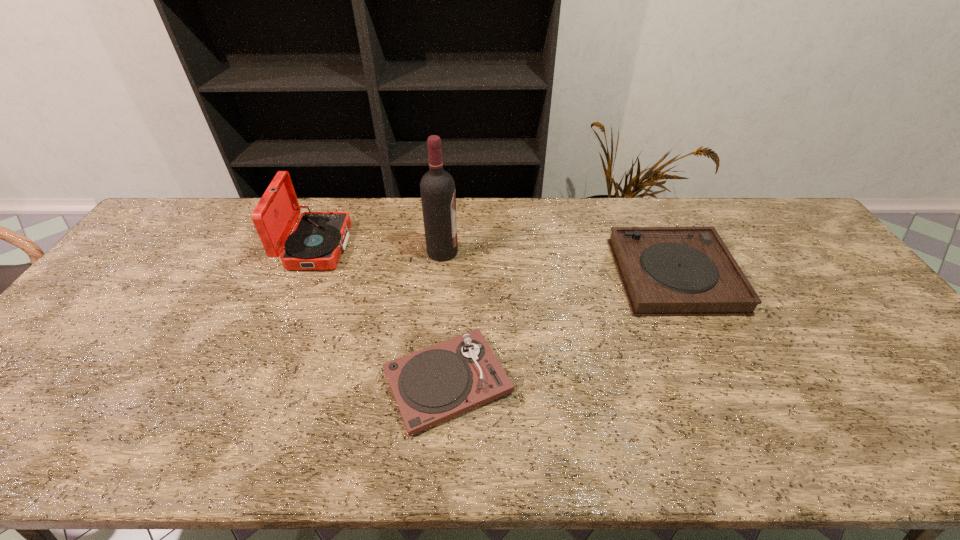
At what (x,y) coordinates should I click in order to perform the action: click on vacant region between the tallest object and the rightmost phonograph_record. Please return your answer as a coordinate pair (x, y). Looking at the image, I should click on (559, 264).

You are a GUI agent. You are given a task and a screenshot of the screen. Output one action in this format:
    pyautogui.click(x=<x>, y=<y>)
    Task: Click on the free space between the tallest object and the nearest object
    This screenshot has height=540, width=960.
    Given the screenshot: What is the action you would take?
    (445, 317)

This screenshot has width=960, height=540. I want to click on free space that is in between the rightmost object and the tallest object, so click(x=559, y=264).

Find the location of a particular element. The width and height of the screenshot is (960, 540). vacant point located between the nearest object and the rightmost phonograph_record is located at coordinates (561, 329).

Find the location of a particular element. This screenshot has width=960, height=540. object that stands as the closest to the rightmost object is located at coordinates (432, 385).

You are a GUI agent. You are given a task and a screenshot of the screen. Output one action in this format:
    pyautogui.click(x=<x>, y=<y>)
    Task: Click on the object that is the third nearest to the nearest object
    
    Given the screenshot: What is the action you would take?
    pyautogui.click(x=666, y=271)

Select which phonograph_record appears as the closest to the second phonograph_record from right to left. Please provide its 2D coordinates. Your answer should be formatted as a tuple, i.e. [(x, y)], where the tuple contains the x and y coordinates of a point satisfying the conditions above.

[(316, 243)]

Identify the location of the second closest phonograph_record relative to the rightmost phonograph_record. (316, 243).

Locate an element on the screen. The image size is (960, 540). vacant area that satisfies the following two spatial constraints: 1. on the back side of the nearest phonograph_record; 2. on the right side of the rightmost phonograph_record is located at coordinates (454, 275).

Image resolution: width=960 pixels, height=540 pixels. In order to click on vacant region that satisfies the following two spatial constraints: 1. on the front-facing side of the leftmost phonograph_record; 2. on the right side of the rightmost phonograph_record in this screenshot , I will do `click(305, 275)`.